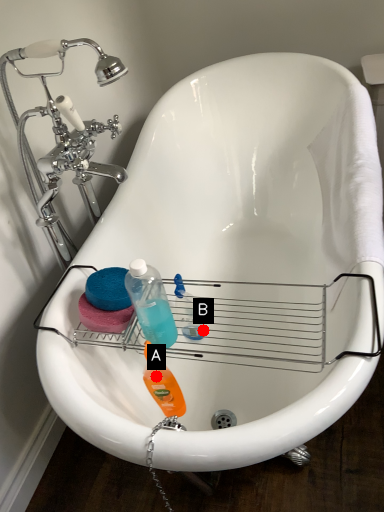
Question: Two points are circled on the image, labeled by A and B beside each circle. Which point is closer to the camera?

Choices:
 (A) A is closer
 (B) B is closer

Answer: (A)